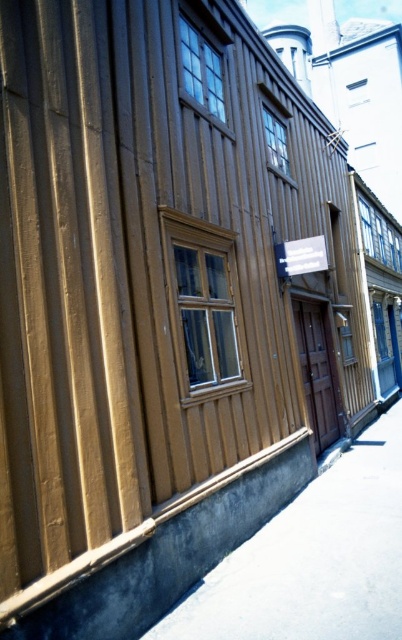
Looking at this image, you are standing in front of a wooden building with two clear glass windows. The windows are labeled as clear glass window at upper center and clear glass window at upper right. Which window is positioned higher up on the building?

The clear glass window at upper right is positioned higher up on the building since the clear glass window at upper center is located below it.

You are an architect designing a new building and want to ensure that the wooden window at center is wider than the clear glass window at center. Based on the image provided, can you confirm if this is the case?

The wooden window at center is wider than the clear glass window at center according to the description provided.

In the scene shown: You are standing in front of the wooden building and want to locate the wooden window at center. Based on the coordinates provided, where would you expect to find it?

The wooden window at center is located at the coordinates point (203,307).